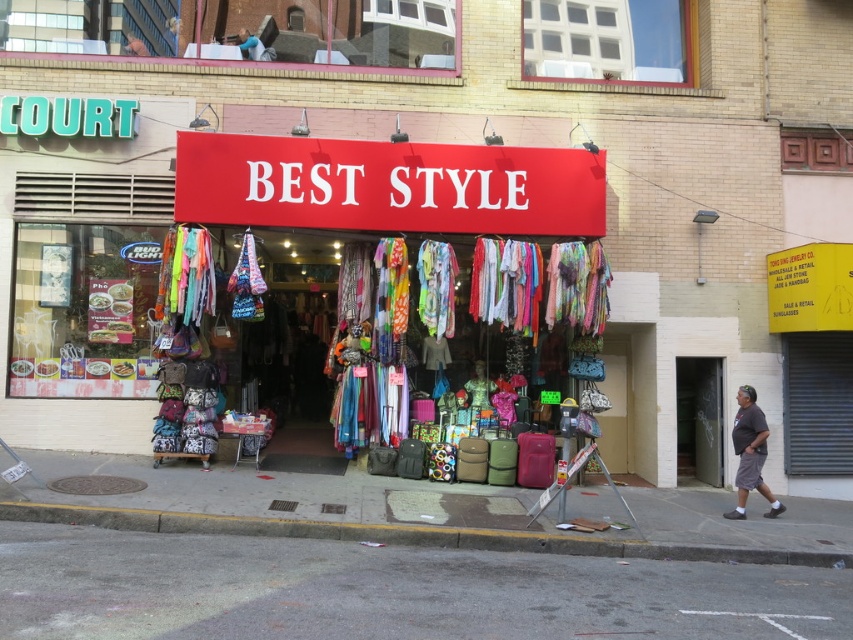
Does gray asphalt at lower center lie in front of textile fabric scarves at center?

Yes.

Who is more distant from viewer, [708,611] or [595,157]?

The point [595,157] is behind.

Is point (492, 596) farther from viewer compared to point (380, 212)?

No, (492, 596) is in front of (380, 212).

I want to click on gray asphalt at lower center, so click(x=389, y=592).

Who is positioned more to the right, gray asphalt at lower center or gray cotton shorts at lower right?

gray cotton shorts at lower right

Is gray asphalt at lower center positioned at the back of gray cotton shorts at lower right?

No, gray asphalt at lower center is closer to the viewer.

The width and height of the screenshot is (853, 640). I want to click on gray asphalt at lower center, so [389, 592].

Find the location of a particular element. This screenshot has height=640, width=853. gray asphalt at lower center is located at coordinates (389, 592).

Is textile fabric scarves at center shorter than concrete at lower left?

Incorrect, textile fabric scarves at center's height does not fall short of concrete at lower left's.

Find the location of a particular element. The width and height of the screenshot is (853, 640). textile fabric scarves at center is located at coordinates tap(389, 186).